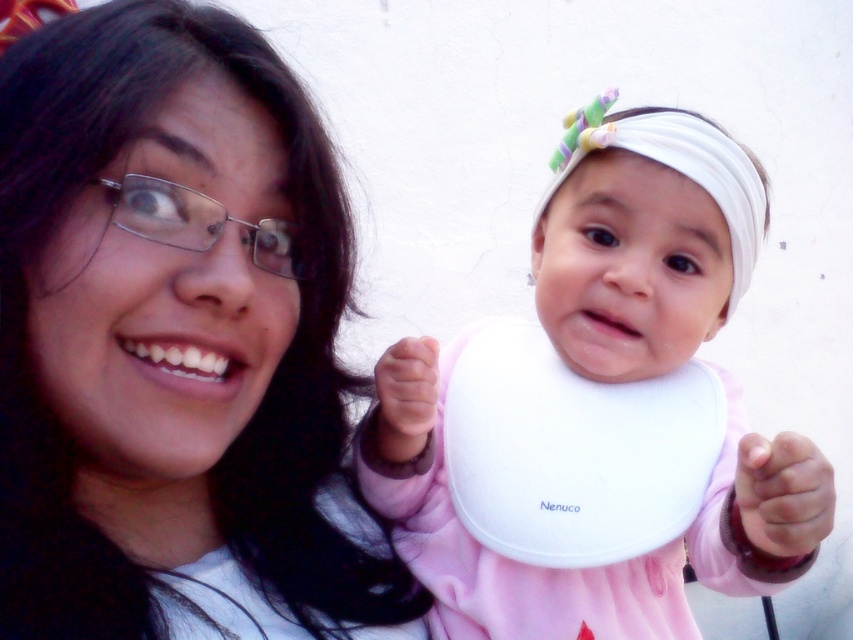
You are a photographer trying to capture a closeup of the pink fabric hand at lower right. Where should you position your camera to ensure it is in the frame?

Position your camera near the point where the pink fabric hand at lower right is located, which is at coordinates approximately 0.772 on the x axis and 0.919 on the y axis.

You are a photographer setting up a photo shoot for a baby clothing catalog. You have two pink fabric hands in the scene. The pink fabric hand at lower right and the pink fabric hand at center. You need to choose which hand to use for the catalog cover. Which hand should you choose to ensure it appears more prominent in the image?

The pink fabric hand at lower right is larger in size than the pink fabric hand at center, so you should choose the pink fabric hand at lower right to ensure it appears more prominent in the image.